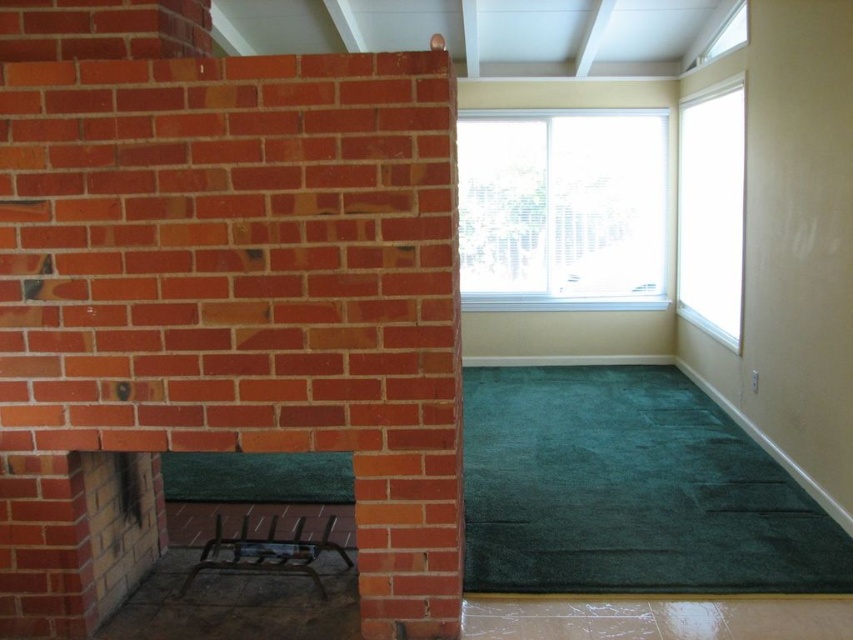
From the picture: You are an interior designer planning to hang a large painting. The painting is 1.8 meters tall. You have two options to place it between the clear glass window at upper center and the metallic grate at lower left. Which object should you choose to ensure the painting can fit vertically without being obstructed?

The clear glass window at upper center has a greater height compared to the metallic grate at lower left, so placing the painting next to the clear glass window at upper center will provide enough vertical space for the painting to fit without obstruction.

In the scene shown: You are standing in the room and want to let in more natural light. Which window should you open wider, the clear glass window at upper center or the transparent glass window at upper right?

The clear glass window at upper center has a larger width than the transparent glass window at upper right, so opening it wider would allow more natural light into the room.

You are standing in the room and want to reach both the metallic grate at lower left and the transparent glass window at upper right. Which object will you encounter first as you move towards them?

You will encounter the metallic grate at lower left first because it is closer to the viewer than the transparent glass window at upper right.